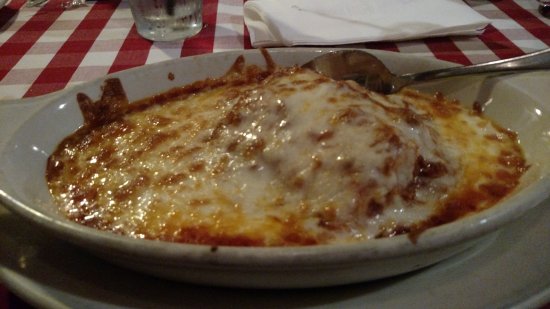
Find the location of `napkin`. napkin is located at coordinates (346, 22).